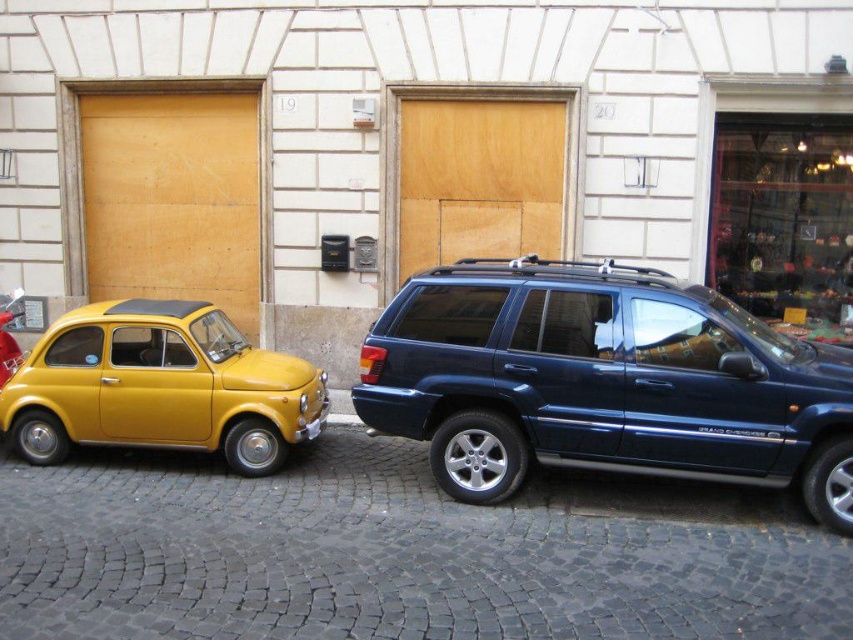
Question: Among these points, which one is farthest from the camera?

Choices:
 (A) click(x=473, y=332)
 (B) click(x=158, y=122)

Answer: (B)

Question: Is yellow matte garage door at left positioned at the back of wooden at center?

Choices:
 (A) no
 (B) yes

Answer: (B)

Question: Is metallic blue minivan at center behind yellow matte garage door at left?

Choices:
 (A) no
 (B) yes

Answer: (A)

Question: Is metallic blue minivan at center further to the viewer compared to wooden at center?

Choices:
 (A) no
 (B) yes

Answer: (A)

Question: Among these points, which one is nearest to the camera?

Choices:
 (A) (44, 452)
 (B) (172, 138)
 (C) (834, 356)

Answer: (C)

Question: Which object is closer to the camera taking this photo?

Choices:
 (A) yellow matte garage door at left
 (B) yellow matte car at left
 (C) metallic blue minivan at center

Answer: (C)